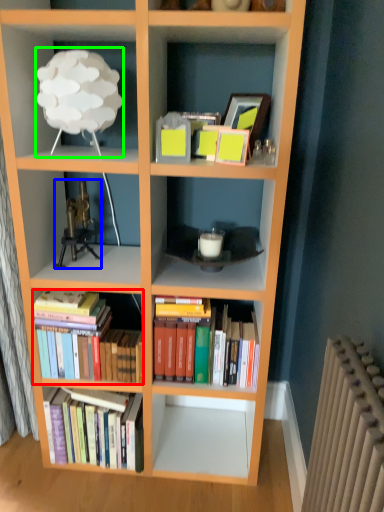
Question: Which object is the farthest from book (highlighted by a red box)? Choose among these: toy (highlighted by a blue box) or lamp (highlighted by a green box).

Choices:
 (A) toy
 (B) lamp

Answer: (B)